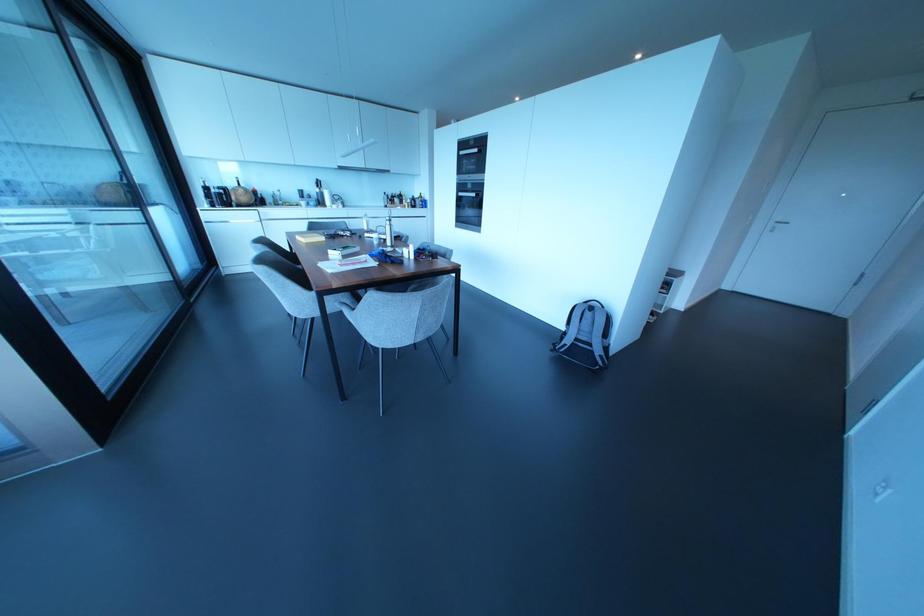
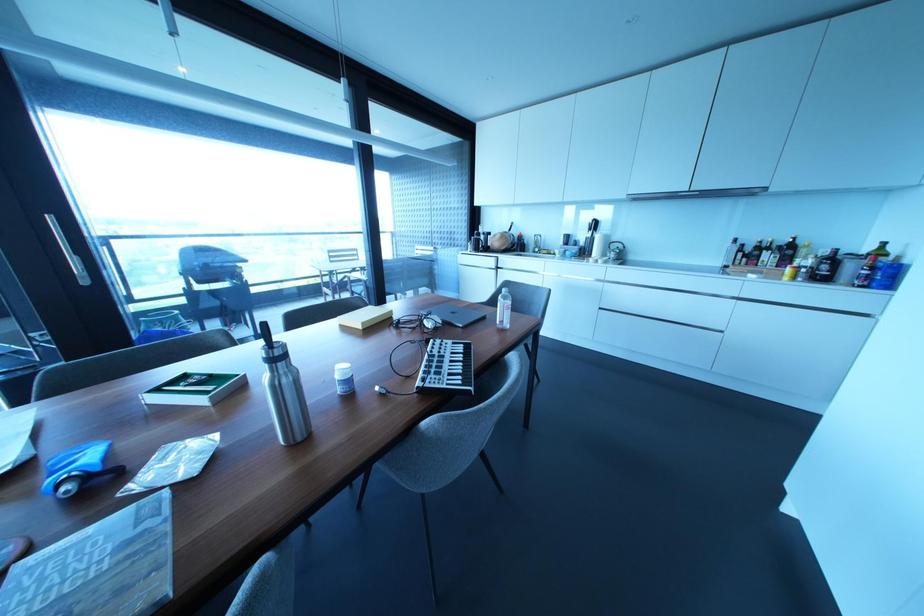
Where in the second image is the point corresponding to (x=335, y=197) from the first image?

(614, 245)